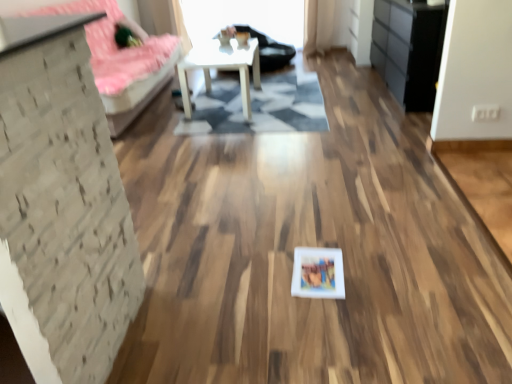
Locate an element on the screen. free space behind matte white picture frame at center is located at coordinates (308, 238).